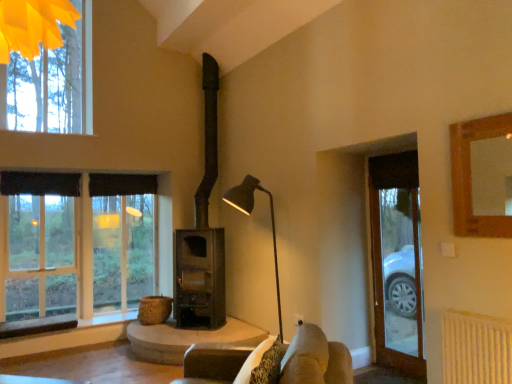
Question: Considering the positions of point (208, 104) and point (272, 218), is point (208, 104) closer or farther from the camera than point (272, 218)?

Choices:
 (A) closer
 (B) farther

Answer: (B)

Question: Is matte black fireplace at center to the left or to the right of black metal floor lamp at center in the image?

Choices:
 (A) right
 (B) left

Answer: (B)

Question: Which object is positioned farthest from the matte glass window at left?

Choices:
 (A) black metal floor lamp at center
 (B) smooth stone table at center
 (C) clear glass door at right
 (D) matte black fireplace at center

Answer: (C)

Question: Estimate the real-world distances between objects in this image. Which object is farther from the smooth stone table at center?

Choices:
 (A) black metal floor lamp at center
 (B) matte glass window at left
 (C) clear glass door at right
 (D) matte black fireplace at center

Answer: (C)